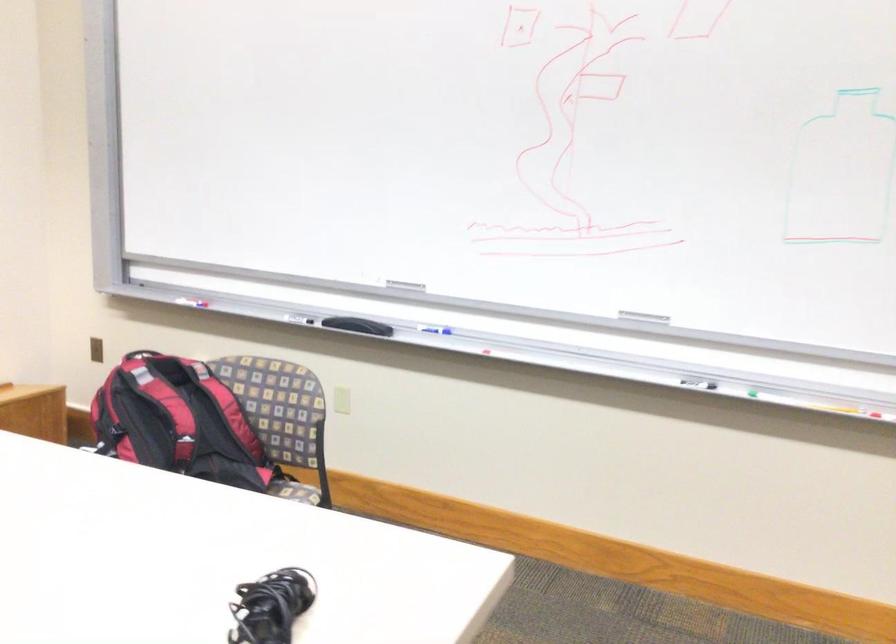
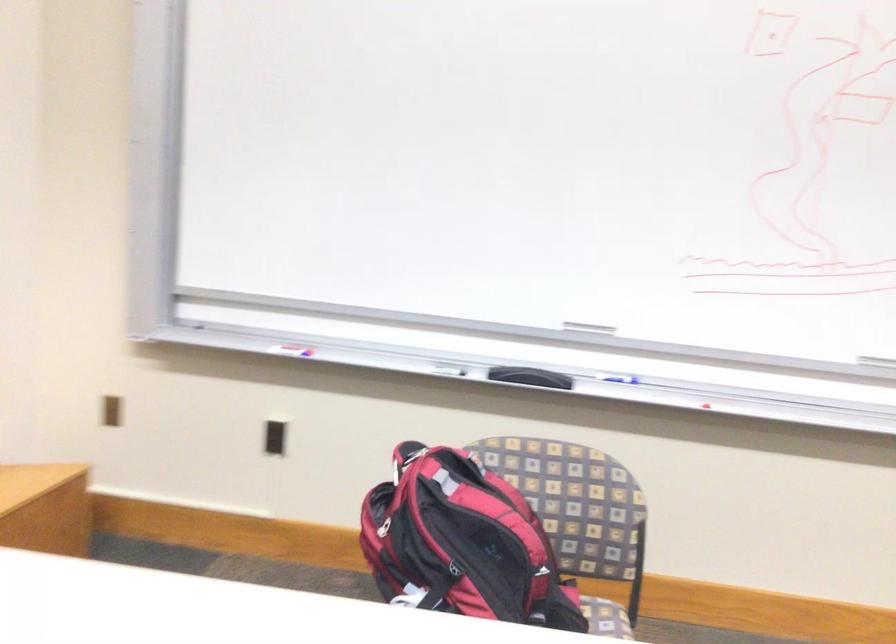
Which direction would the cameraman need to move to produce the second image?

The cameraman walked toward left, forward.